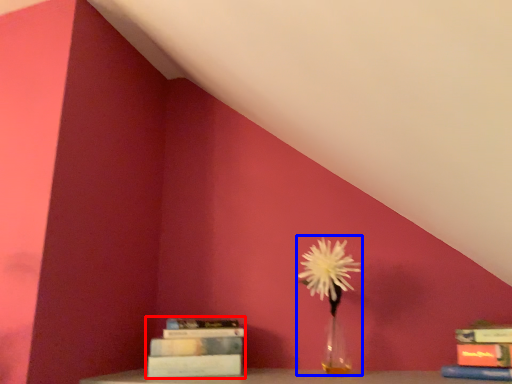
Question: Which object is closer to the camera taking this photo, book (highlighted by a red box) or floral arrangement (highlighted by a blue box)?

Choices:
 (A) book
 (B) floral arrangement

Answer: (B)